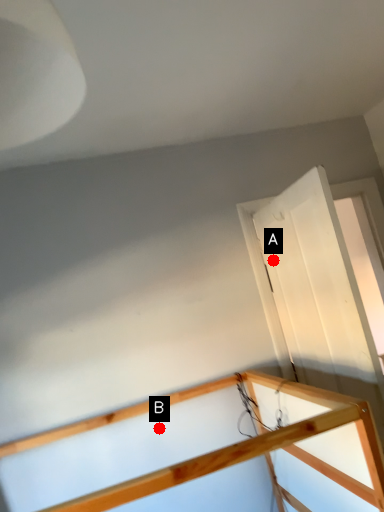
Question: Two points are circled on the image, labeled by A and B beside each circle. Which of the following is the farthest from the observer?

Choices:
 (A) A is further
 (B) B is further

Answer: (A)